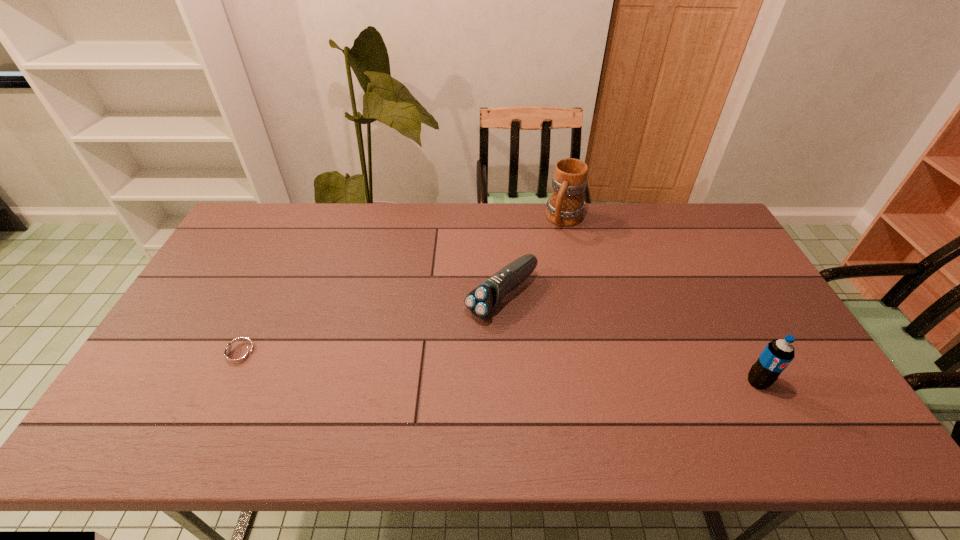
This screenshot has width=960, height=540. What are the coordinates of `empty location between the second object from right to left and the rightmost object` in the screenshot? It's located at (661, 301).

Where is `blank region between the third object from right to left and the leftmost object`? This screenshot has height=540, width=960. blank region between the third object from right to left and the leftmost object is located at coordinates (371, 325).

Where is `vacant area that lies between the third object from left to right and the watch`? The width and height of the screenshot is (960, 540). vacant area that lies between the third object from left to right and the watch is located at coordinates (402, 287).

Identify the location of free spot between the watch and the second shortest object. (371, 325).

Identify the location of vacant space that is in between the leftmost object and the mug. (402, 287).

At what (x,y) coordinates should I click in order to perform the action: click on blank region between the watch and the rightmost object. Please return your answer as a coordinate pair (x, y). This screenshot has width=960, height=540. Looking at the image, I should click on (498, 368).

At what (x,y) coordinates should I click in order to perform the action: click on empty location between the leftmost object and the farthest object. Please return your answer as a coordinate pair (x, y). The image size is (960, 540). Looking at the image, I should click on (402, 287).

Identify the location of object that is the third closest to the soda bottle. (239, 354).

Identify which object is located as the third nearest to the farthest object. Please provide its 2D coordinates. Your answer should be formatted as a tuple, i.e. [(x, y)], where the tuple contains the x and y coordinates of a point satisfying the conditions above.

[(239, 354)]